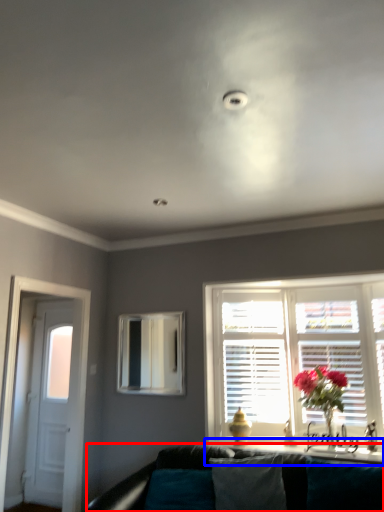
Question: Which object appears farthest to the camera in this image, studio couch (highlighted by a red box) or window sill (highlighted by a blue box)?

Choices:
 (A) studio couch
 (B) window sill

Answer: (B)